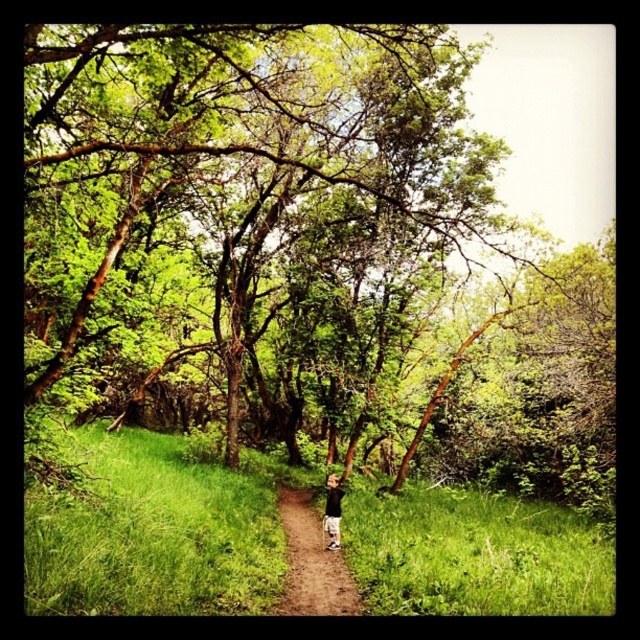
Question: Based on their relative distances, which object is farther from the brown dirt path at center?

Choices:
 (A) black cotton shirt at center
 (B) green leafy tree at center

Answer: (B)

Question: Which point is closer to the camera?

Choices:
 (A) (360, 353)
 (B) (323, 518)
 (C) (330, 604)

Answer: (C)

Question: From the image, what is the correct spatial relationship of green leafy tree at center in relation to brown dirt path at center?

Choices:
 (A) right
 (B) left

Answer: (A)

Question: Which object is closer to the camera taking this photo?

Choices:
 (A) black cotton shirt at center
 (B) brown dirt path at center
 (C) green leafy tree at center

Answer: (C)

Question: Can you confirm if green leafy tree at center is smaller than brown dirt path at center?

Choices:
 (A) yes
 (B) no

Answer: (B)

Question: Is green leafy tree at center to the left of black cotton shirt at center from the viewer's perspective?

Choices:
 (A) no
 (B) yes

Answer: (B)